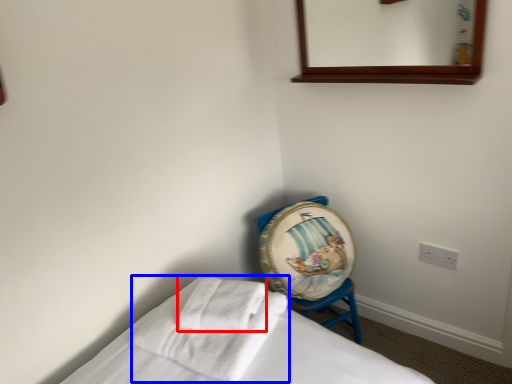
Question: Which object is further to the camera taking this photo, bath towel (highlighted by a red box) or bath towel (highlighted by a blue box)?

Choices:
 (A) bath towel
 (B) bath towel

Answer: (A)